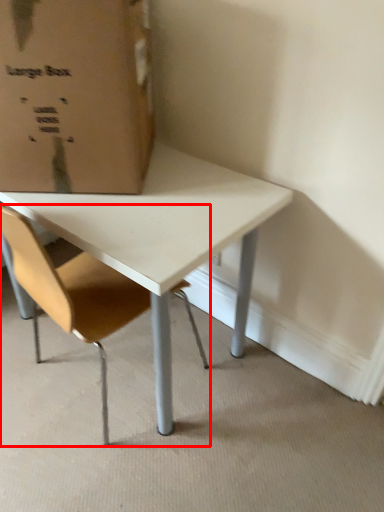
Question: From the image's perspective, what is the correct spatial positioning of chair (annotated by the red box) in reference to cardboard box?

Choices:
 (A) below
 (B) above

Answer: (A)